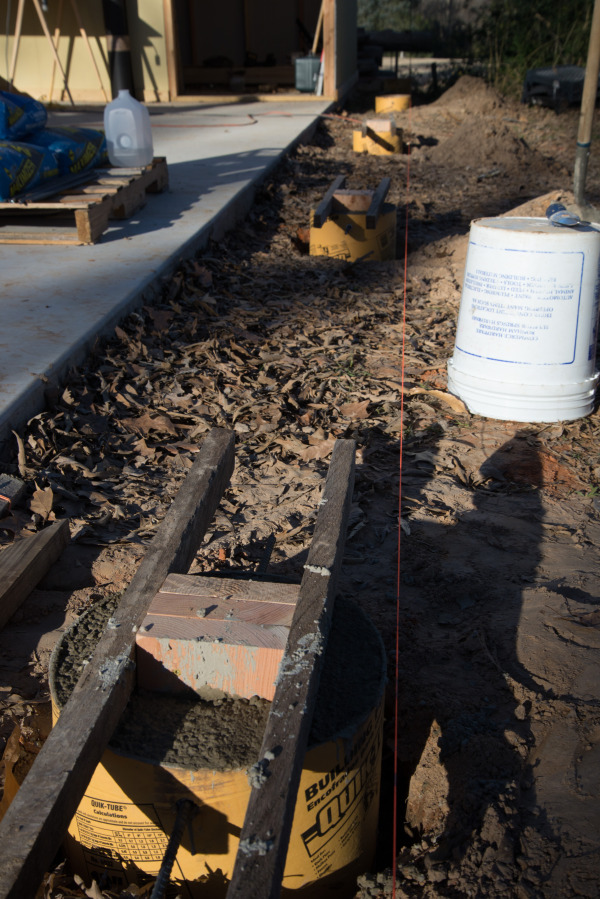
What are the coordinates of `bin` in the screenshot? It's located at (357, 812).